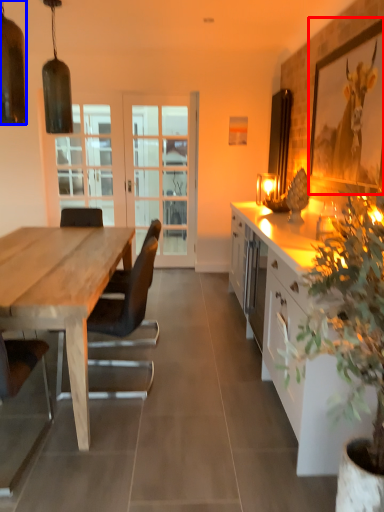
Question: Which object is further to the camera taking this photo, picture frame (highlighted by a red box) or lamp (highlighted by a blue box)?

Choices:
 (A) picture frame
 (B) lamp

Answer: (A)